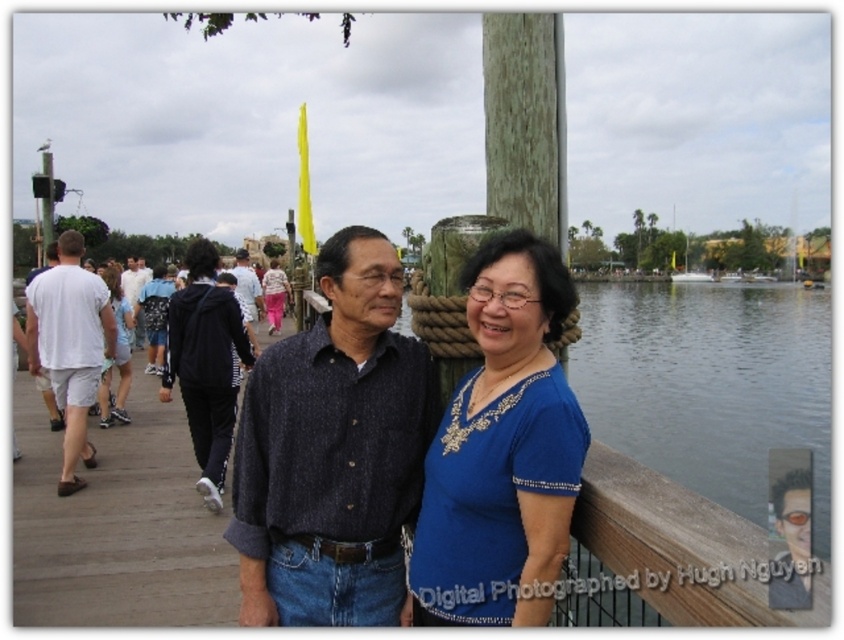
Question: Which of the following is the closest to the observer?

Choices:
 (A) light blue jeans at center
 (B) light pink fabric pants at center
 (C) white cotton shorts at left
 (D) black fleece jacket at left

Answer: (D)

Question: Based on their relative distances, which object is farther from the white cotton shorts at left?

Choices:
 (A) light pink fabric pants at center
 (B) black fleece jacket at left
 (C) brown wooden rail at right
 (D) light blue fabric dress at left

Answer: (A)

Question: Considering the relative positions of brown wooden rail at right and light blue jeans at center in the image provided, where is brown wooden rail at right located with respect to light blue jeans at center?

Choices:
 (A) above
 (B) below

Answer: (B)

Question: Is light pink fabric pants at center to the right of light blue jeans at center from the viewer's perspective?

Choices:
 (A) no
 (B) yes

Answer: (B)

Question: Can you confirm if black fleece jacket at left is positioned to the left of light blue jeans at center?

Choices:
 (A) yes
 (B) no

Answer: (B)

Question: Which object is the closest to the light blue fabric dress at left?

Choices:
 (A) light pink fabric pants at center
 (B) light blue jeans at center
 (C) white cotton shorts at left

Answer: (C)